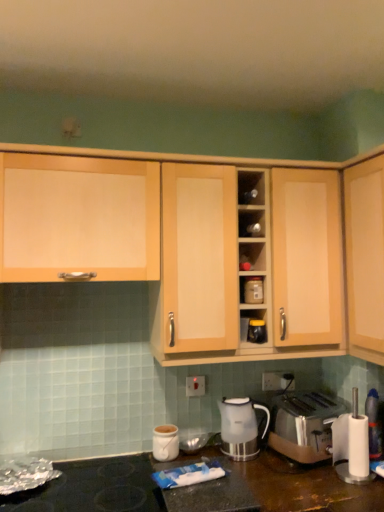
Question: Does matte plastic container at center, which is counted as the 1th appliance, starting from the top, lie in front of satin gold toaster at lower right?

Choices:
 (A) no
 (B) yes

Answer: (A)

Question: Is the position of matte plastic container at center, which is counted as the 1th appliance, starting from the top, more distant than that of satin gold toaster at lower right?

Choices:
 (A) yes
 (B) no

Answer: (A)

Question: From the image's perspective, is matte plastic container at center, the 2th appliance when ordered from bottom to top, below satin gold toaster at lower right?

Choices:
 (A) yes
 (B) no

Answer: (B)

Question: Is matte plastic container at center, which is counted as the 1th appliance, starting from the top, thinner than satin gold toaster at lower right?

Choices:
 (A) no
 (B) yes

Answer: (B)

Question: Does matte plastic container at center, the 2th appliance when ordered from bottom to top, have a greater width compared to satin gold toaster at lower right?

Choices:
 (A) yes
 (B) no

Answer: (B)

Question: Is white plastic electric outlet at center, acting as the 1th electric outlet starting from the left, bigger or smaller than white plastic blender at lower right?

Choices:
 (A) small
 (B) big

Answer: (A)

Question: From their relative heights in the image, would you say white plastic electric outlet at center, acting as the 1th electric outlet starting from the left, is taller or shorter than white plastic blender at lower right?

Choices:
 (A) short
 (B) tall

Answer: (A)

Question: Is white plastic electric outlet at center, acting as the 1th electric outlet starting from the left, inside the boundaries of white plastic blender at lower right, or outside?

Choices:
 (A) outside
 (B) inside

Answer: (A)

Question: Does point (195, 376) appear closer or farther from the camera than point (337, 442)?

Choices:
 (A) farther
 (B) closer

Answer: (A)

Question: Does point (352, 451) appear closer or farther from the camera than point (57, 496)?

Choices:
 (A) farther
 (B) closer

Answer: (A)

Question: Do you think white plastic blender at lower right is within black matte gas stove at lower left, or outside of it?

Choices:
 (A) inside
 (B) outside

Answer: (B)

Question: From the image's perspective, is white plastic blender at lower right above or below black matte gas stove at lower left?

Choices:
 (A) above
 (B) below

Answer: (A)

Question: In the image, is white plastic blender at lower right positioned in front of or behind black matte gas stove at lower left?

Choices:
 (A) front
 (B) behind

Answer: (B)

Question: From a real-world perspective, is black matte gas stove at lower left positioned above or below matte plastic container at center, which is counted as the 1th appliance, starting from the top?

Choices:
 (A) above
 (B) below

Answer: (B)

Question: Considering the positions of black matte gas stove at lower left and matte plastic container at center, the 2th appliance when ordered from bottom to top, in the image, is black matte gas stove at lower left wider or thinner than matte plastic container at center, the 2th appliance when ordered from bottom to top,?

Choices:
 (A) thin
 (B) wide

Answer: (B)